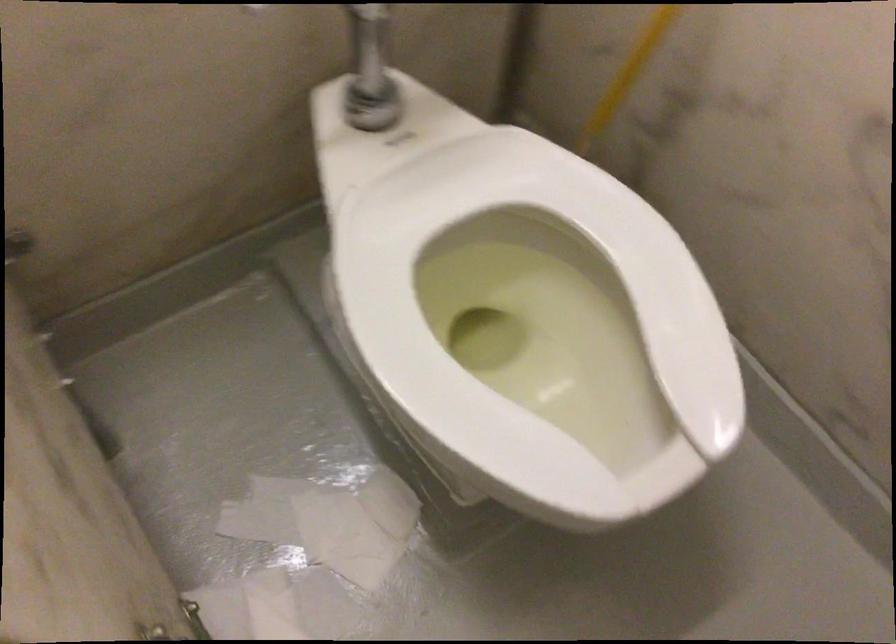
Where would you push the silver flush button? Please return your answer as a coordinate pair (x, y).

(362, 96)